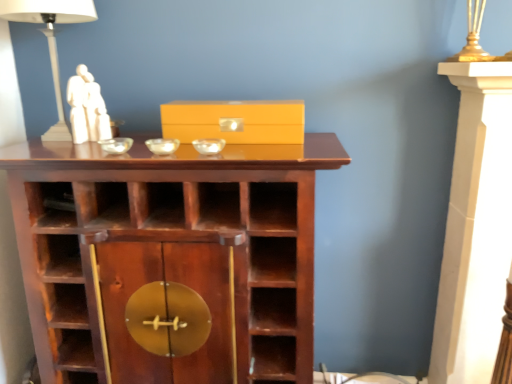
Where is `unoccupied area in front of matte yellow box at center`? The height and width of the screenshot is (384, 512). unoccupied area in front of matte yellow box at center is located at coordinates (234, 142).